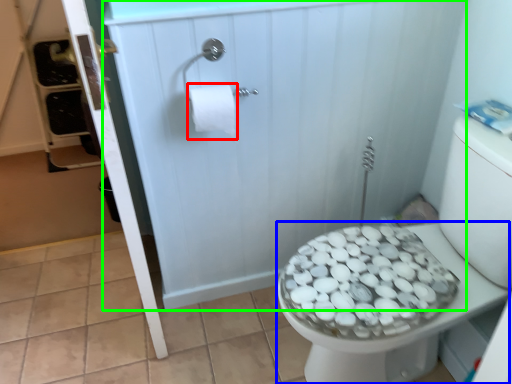
Question: Which object is positioned closest to toilet paper (highlighted by a red box)? Select from bidet (highlighted by a blue box) and screen door (highlighted by a green box).

Choices:
 (A) bidet
 (B) screen door

Answer: (B)